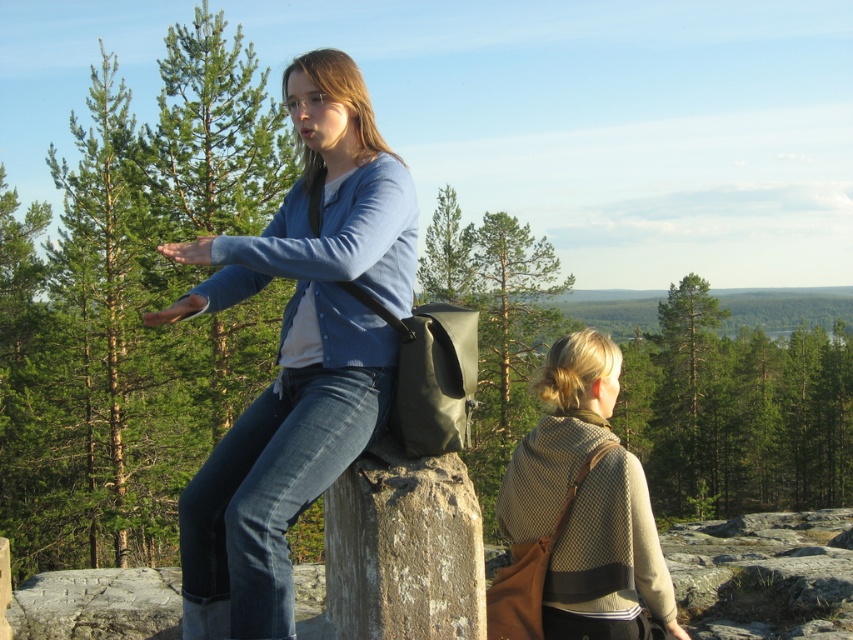
You are a fashion designer observing the two items in the scene. Which item has a smaller width between the matte blue shirt at center and the beige woolen shawl at center?

The matte blue shirt at center has a smaller width than the beige woolen shawl at center.

You are a photographer trying to capture a photo of the matte blue shirt at center. You need to position yourself so that the shirt is centered in your viewfinder. Given the coordinates provided, where should you aim your camera relative to the image frame?

The matte blue shirt at center is located at point coordinates (297, 353). To center it in your viewfinder, aim your camera slightly to the right and down from the image frame center, as the coordinates indicate it is positioned right of center horizontally and below center vertically.